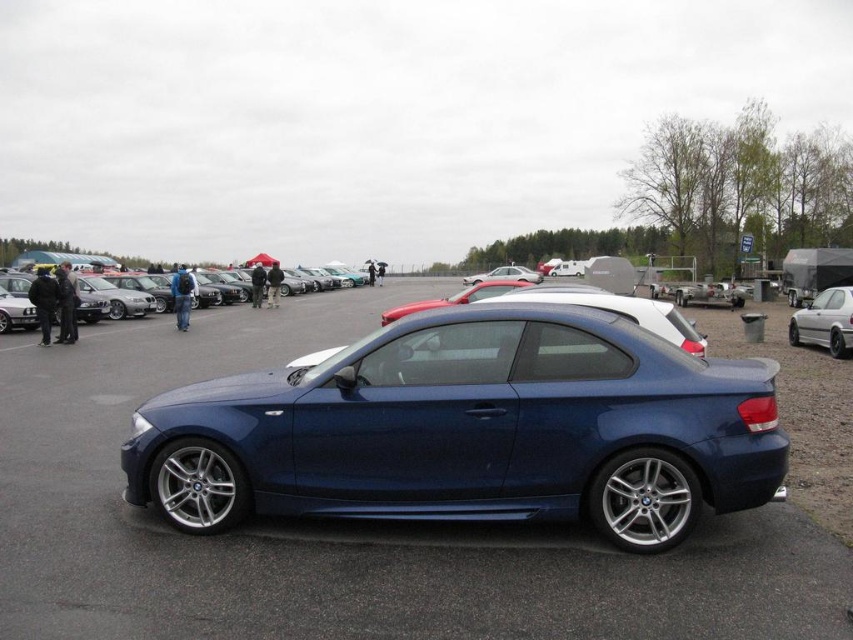
Who is more distant from viewer, (160, 374) or (849, 292)?

The point (849, 292) is more distant.

Can you confirm if metallic blue car at center is positioned to the left of white matte sedan at right?

Correct, you'll find metallic blue car at center to the left of white matte sedan at right.

The image size is (853, 640). Describe the element at coordinates (363, 522) in the screenshot. I see `metallic blue car at center` at that location.

Image resolution: width=853 pixels, height=640 pixels. Identify the location of metallic blue car at center. (363, 522).

Is matte black car at center positioned at the back of white matte sedan at right?

Yes, matte black car at center is further from the viewer.

The height and width of the screenshot is (640, 853). What do you see at coordinates (135, 291) in the screenshot?
I see `matte black car at center` at bounding box center [135, 291].

What do you see at coordinates (135, 291) in the screenshot? I see `matte black car at center` at bounding box center [135, 291].

This screenshot has height=640, width=853. What are the coordinates of `matte black car at center` in the screenshot? It's located at (135, 291).

Is metallic blue car at center below matte black car at center?

Indeed, metallic blue car at center is positioned under matte black car at center.

Is point (332, 605) positioned after point (112, 304)?

No, (332, 605) is closer to viewer.

Where is `metallic blue car at center`? metallic blue car at center is located at coordinates (363, 522).